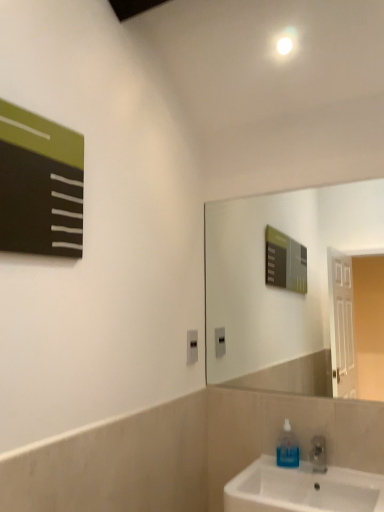
Question: Is transparent blue liquid at sink right taller than matte black board at upper left?

Choices:
 (A) no
 (B) yes

Answer: (A)

Question: Is matte black board at upper left completely or partially inside transparent blue liquid at sink right?

Choices:
 (A) no
 (B) yes

Answer: (A)

Question: Considering the relative sizes of transparent blue liquid at sink right and matte black board at upper left in the image provided, is transparent blue liquid at sink right wider than matte black board at upper left?

Choices:
 (A) no
 (B) yes

Answer: (B)

Question: From the image's perspective, is transparent blue liquid at sink right below matte black board at upper left?

Choices:
 (A) yes
 (B) no

Answer: (A)

Question: Could you tell me if transparent blue liquid at sink right is facing matte black board at upper left?

Choices:
 (A) yes
 (B) no

Answer: (B)

Question: From the image's perspective, is transparent blue liquid at sink right on top of matte black board at upper left?

Choices:
 (A) no
 (B) yes

Answer: (A)

Question: Is matte black board at upper left oriented towards transparent blue liquid at sink right?

Choices:
 (A) no
 (B) yes

Answer: (A)

Question: Can you confirm if matte black board at upper left is wider than transparent blue liquid at sink right?

Choices:
 (A) yes
 (B) no

Answer: (B)

Question: Considering the relative sizes of matte black board at upper left and transparent blue liquid at sink right in the image provided, is matte black board at upper left shorter than transparent blue liquid at sink right?

Choices:
 (A) no
 (B) yes

Answer: (A)

Question: Is matte black board at upper left positioned behind transparent blue liquid at sink right?

Choices:
 (A) no
 (B) yes

Answer: (A)

Question: Would you consider matte black board at upper left to be distant from transparent blue liquid at sink right?

Choices:
 (A) no
 (B) yes

Answer: (B)

Question: Does matte black board at upper left have a smaller size compared to transparent blue liquid at sink right?

Choices:
 (A) yes
 (B) no

Answer: (B)

Question: Can you confirm if white glossy sink at lower right is wider than transparent blue liquid at sink right?

Choices:
 (A) yes
 (B) no

Answer: (A)